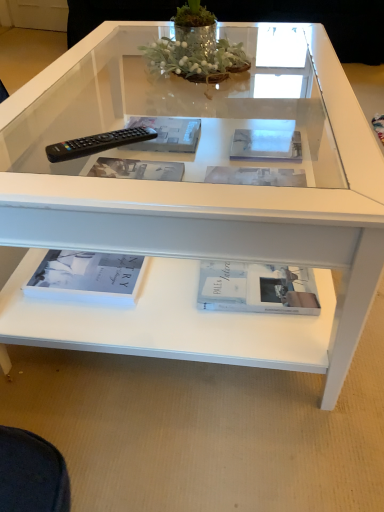
Question: From a real-world perspective, is clear plastic magazine at center, positioned as the 1th magazine in left-to-right order, over white glossy magazine at center, which is counted as the first magazine, starting from the right?

Choices:
 (A) yes
 (B) no

Answer: (A)

Question: Is white glossy magazine at center, arranged as the second magazine when viewed from the left, inside clear plastic magazine at center, the second magazine from the right?

Choices:
 (A) no
 (B) yes

Answer: (A)

Question: Does clear plastic magazine at center, the second magazine from the right, have a lesser width compared to white glossy magazine at center, which is counted as the first magazine, starting from the right?

Choices:
 (A) no
 (B) yes

Answer: (A)

Question: Is clear plastic magazine at center, the second magazine from the right, completely or partially outside of white glossy magazine at center, which is counted as the first magazine, starting from the right?

Choices:
 (A) no
 (B) yes

Answer: (B)

Question: Is white glossy magazine at center, which is counted as the first magazine, starting from the right, at the back of clear plastic magazine at center, positioned as the 1th magazine in left-to-right order?

Choices:
 (A) no
 (B) yes

Answer: (A)

Question: Is clear plastic magazine at center, positioned as the 1th magazine in left-to-right order, further to the viewer compared to white glossy magazine at center, arranged as the second magazine when viewed from the left?

Choices:
 (A) no
 (B) yes

Answer: (B)

Question: From a real-world perspective, does white matte book at lower center, which is counted as the first book, starting from the right, sit lower than black plastic remote at left?

Choices:
 (A) yes
 (B) no

Answer: (A)

Question: From the image's perspective, does white matte book at lower center, which is counted as the first book, starting from the right, appear higher than black plastic remote at left?

Choices:
 (A) no
 (B) yes

Answer: (A)

Question: Is white matte book at lower center, which ranks as the second book in left-to-right order, facing away from black plastic remote at left?

Choices:
 (A) yes
 (B) no

Answer: (B)

Question: Is white matte book at lower center, which ranks as the second book in left-to-right order, far away from black plastic remote at left?

Choices:
 (A) no
 (B) yes

Answer: (A)

Question: Can you confirm if white matte book at lower center, which ranks as the second book in left-to-right order, is positioned to the left of black plastic remote at left?

Choices:
 (A) no
 (B) yes

Answer: (A)

Question: Can you confirm if white matte book at lower center, which is counted as the first book, starting from the right, is taller than black plastic remote at left?

Choices:
 (A) yes
 (B) no

Answer: (A)

Question: Does white glossy magazine at center, which is counted as the first magazine, starting from the right, have a greater width compared to clear plastic magazine at center, the second magazine from the right?

Choices:
 (A) no
 (B) yes

Answer: (A)